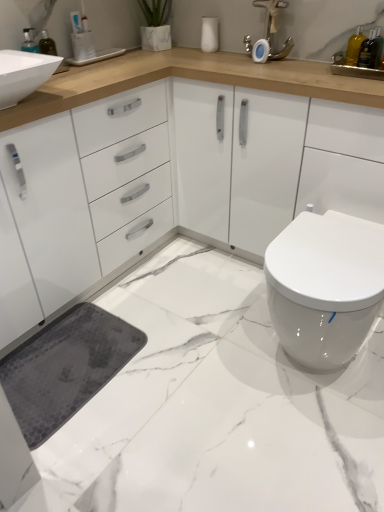
Question: Is blue plastic toothbrush at upper left, positioned as the 2th toiletry in bottom-to-top order, spatially inside white glossy toilet at lower right, or outside of it?

Choices:
 (A) inside
 (B) outside

Answer: (B)

Question: Is blue plastic toothbrush at upper left, which ranks as the 2th toiletry in right-to-left order, in front of or behind white glossy toilet at lower right in the image?

Choices:
 (A) behind
 (B) front

Answer: (A)

Question: Which object is positioned closest to the blue plastic toothbrush at upper left, the 1th toiletry from the left?

Choices:
 (A) translucent glass bottle at upper right, the 2th sink from the left
 (B) white marble floor at lower right
 (C) matte silver faucet at upper center
 (D) white glossy sink at upper left, the first sink in the left-to-right sequence
 (E) translucent glass bottle at upper right, the first toiletry in the front-to-back sequence

Answer: (D)

Question: Which is farther from the white glossy sink at upper left, the second sink when ordered from right to left?

Choices:
 (A) matte silver faucet at upper center
 (B) white glossy toilet at lower right
 (C) translucent glass bottle at upper right, the first toiletry in the front-to-back sequence
 (D) white marble floor at lower right
 (E) blue plastic toothbrush at upper left, positioned as the 2th toiletry in bottom-to-top order

Answer: (C)